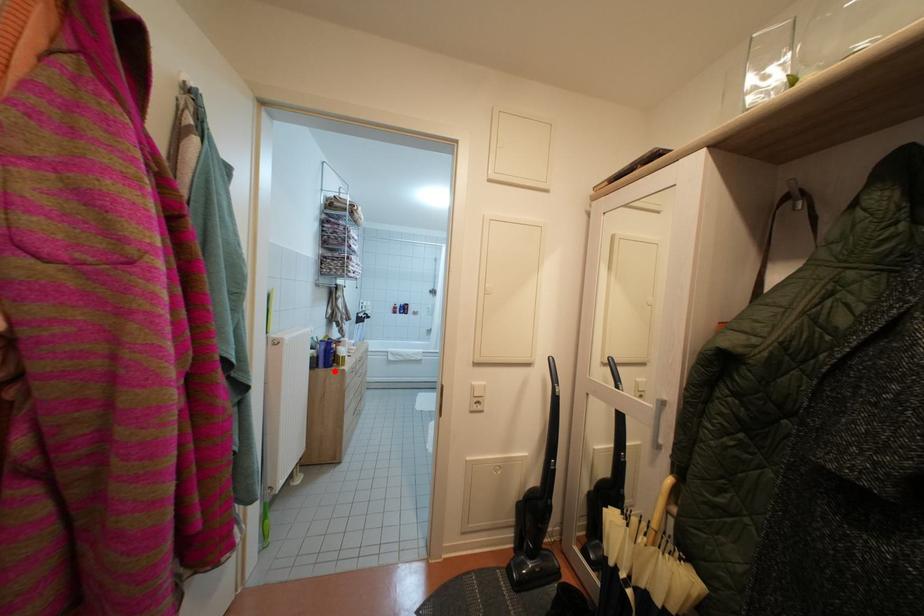
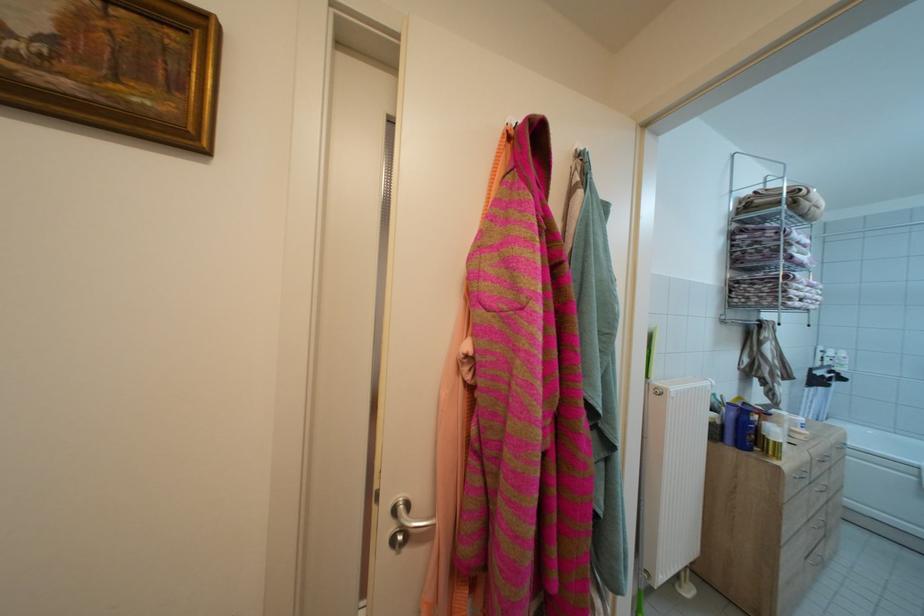
Question: I am providing you with two images of the same scene from different viewpoints. Given a red point in image1, look at the same physical point in image2. Is it:

Choices:
 (A) Closer to the viewpoint
 (B) Farther from the viewpoint

Answer: (B)